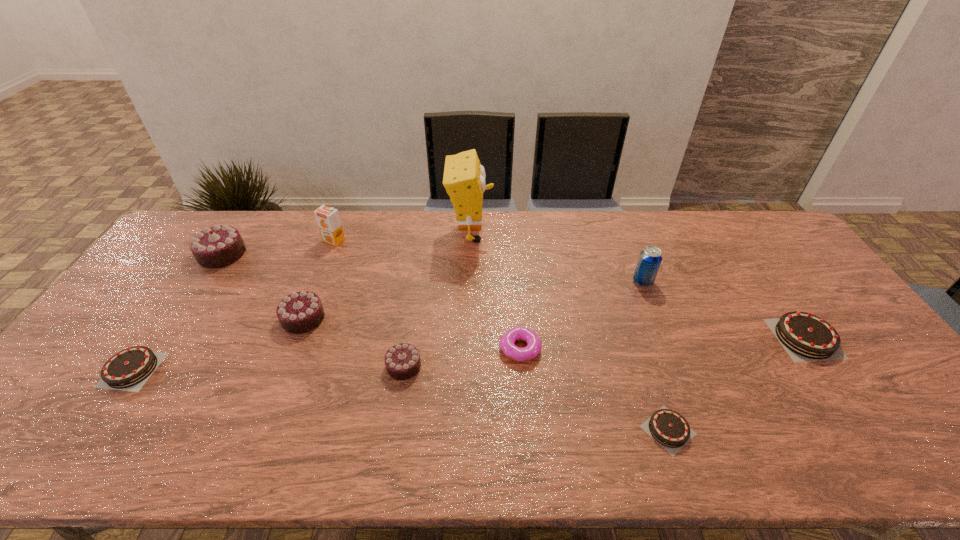
In order to click on orange juice present at the far edge in this screenshot , I will do `click(328, 220)`.

Image resolution: width=960 pixels, height=540 pixels. I want to click on chocolate cake situated at the far edge, so click(218, 246).

I want to click on object that is positioned at the near edge, so click(668, 428).

Image resolution: width=960 pixels, height=540 pixels. I want to click on object at the right edge, so click(805, 337).

You are a GUI agent. You are given a task and a screenshot of the screen. Output one action in this format:
    pyautogui.click(x=<x>, y=<y>)
    Task: Click on the object located at the far left corner
    Image resolution: width=960 pixels, height=540 pixels.
    Given the screenshot: What is the action you would take?
    pyautogui.click(x=218, y=246)

Where is `vacant area at the far edge`? Image resolution: width=960 pixels, height=540 pixels. vacant area at the far edge is located at coordinates (612, 242).

Identify the location of vacant space at the left edge of the desktop. (81, 374).

Locate an element on the screen. This screenshot has height=540, width=960. free region at the right edge of the desktop is located at coordinates (890, 369).

The height and width of the screenshot is (540, 960). Identify the location of vacant space at the far right corner of the desktop. (751, 238).

You are a GUI agent. You are given a task and a screenshot of the screen. Output one action in this format:
    pyautogui.click(x=<x>, y=<y>)
    Task: Click on the vacant area that lies between the pink doughnut and the sponge
    
    Given the screenshot: What is the action you would take?
    pyautogui.click(x=495, y=291)